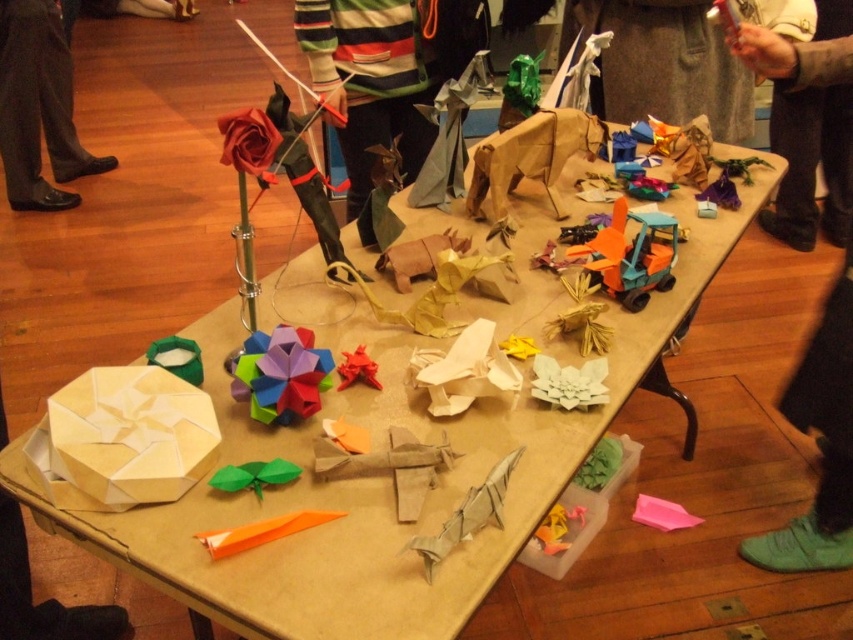
You are organizing a childrens craft fair and need to display two items from the table. The green matte origami at center and the rubberized plastic origami star at center. Which one should you choose if you want to display the taller item?

The green matte origami at center is much taller than the rubberized plastic origami star at center, so you should choose the green matte origami at center for displaying the taller item.

You are a delivery robot with a package that needs to be placed between the striped sweater at upper center and the multicolored paper at center. The package is 30 inches long. Can you fit it between them?

The distance between the striped sweater at upper center and the multicolored paper at center is 35.36 inches. Since the package is 30 inches long, it can fit between them as there is enough space.